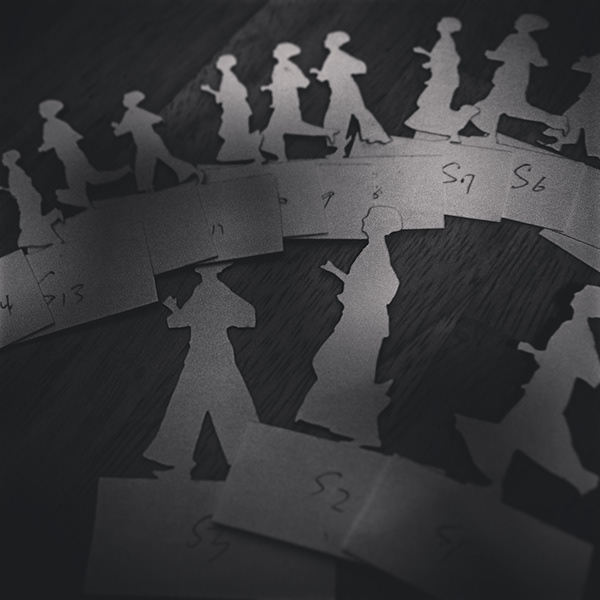
At what (x,y) coordinates should I click in order to perform the action: click on table. Please return your answer as a coordinate pair (x, y). The width and height of the screenshot is (600, 600). Looking at the image, I should click on (453, 334).